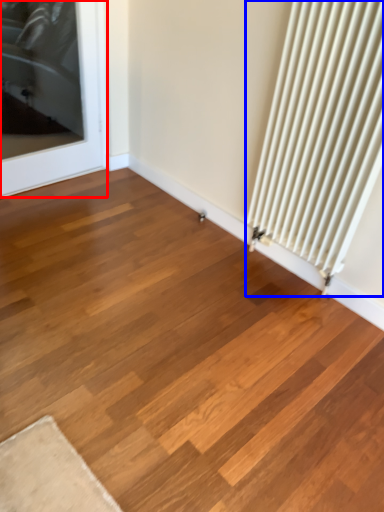
Question: Among these objects, which one is nearest to the camera, door (highlighted by a red box) or radiator (highlighted by a blue box)?

Choices:
 (A) door
 (B) radiator

Answer: (B)